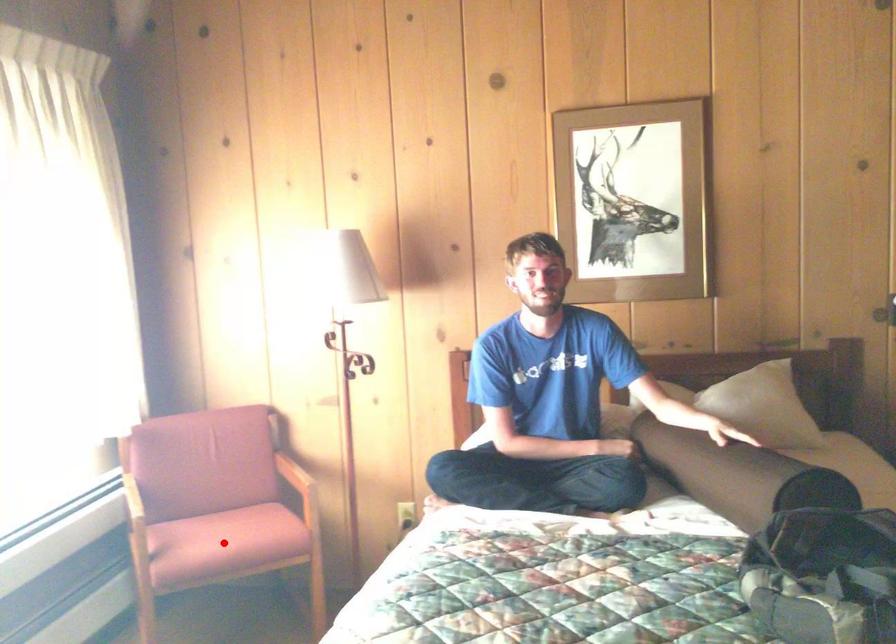
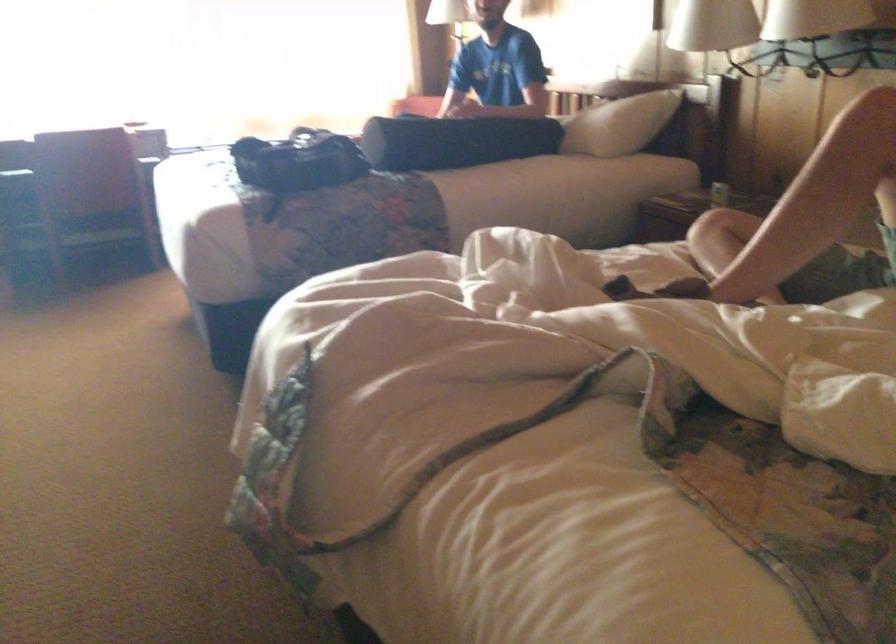
Question: I am providing you with two images of the same scene from different viewpoints. A red point is marked on the first image. Is the red point's position out of view in image 2?

Choices:
 (A) Yes
 (B) No

Answer: (A)